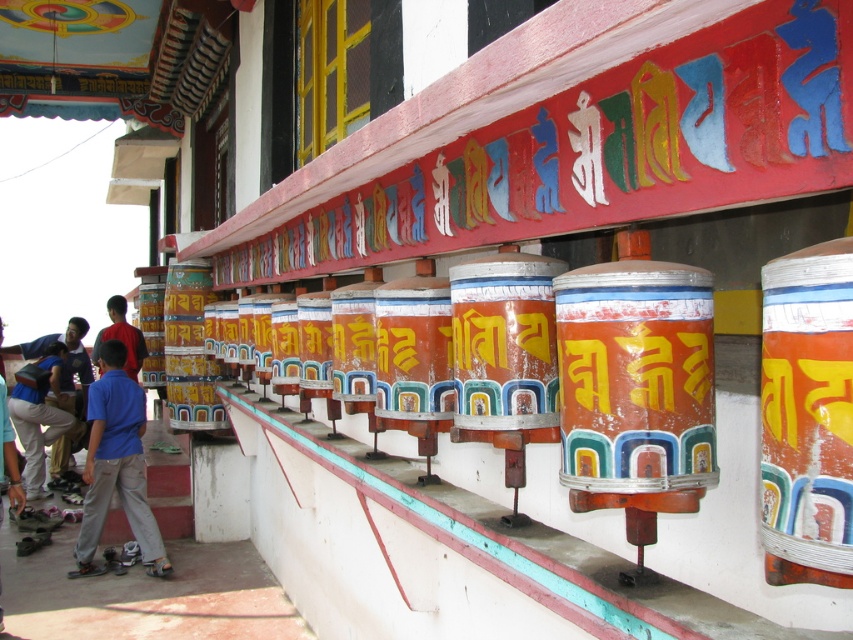
Does blue denim jeans at lower left come in front of blue shirt at lower left?

Yes, blue denim jeans at lower left is closer to the viewer.

Does blue denim jeans at lower left have a greater height compared to blue shirt at lower left?

Yes, blue denim jeans at lower left is taller than blue shirt at lower left.

Is point (57, 358) positioned before point (140, 362)?

No, it is behind (140, 362).

Find the location of a particular element. blue denim jeans at lower left is located at coordinates (39, 419).

In the scene shown: Is blue fabric shirt at lower left bigger than blue denim jeans at lower left?

No.

Between blue fabric shirt at lower left and blue denim jeans at lower left, which one appears on the left side from the viewer's perspective?

blue denim jeans at lower left

Image resolution: width=853 pixels, height=640 pixels. In order to click on blue fabric shirt at lower left in this screenshot , I will do `click(115, 465)`.

Looking at this image, is blue fabric shirt at lower left below blue shirt at lower left?

Indeed, blue fabric shirt at lower left is positioned under blue shirt at lower left.

Find the location of a particular element. The height and width of the screenshot is (640, 853). blue fabric shirt at lower left is located at coordinates (115, 465).

At what (x,y) coordinates should I click in order to perform the action: click on blue fabric shirt at lower left. Please return your answer as a coordinate pair (x, y). Looking at the image, I should click on coord(115,465).